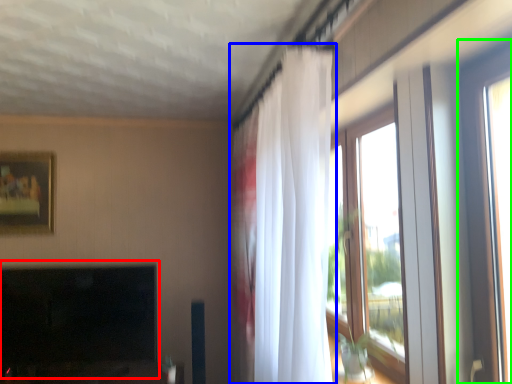
Question: Based on their relative distances, which object is farther from fireplace (highlighted by a red box)? Choose from curtain (highlighted by a blue box) and window (highlighted by a green box).

Choices:
 (A) curtain
 (B) window

Answer: (B)